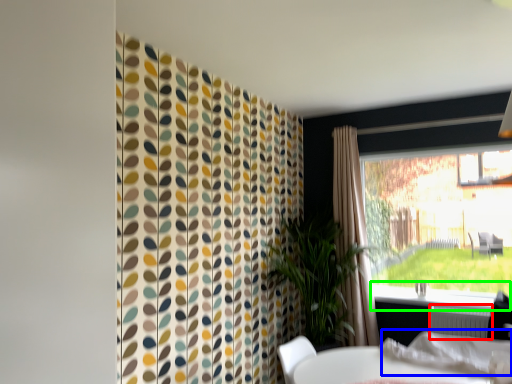
Question: Which is farther away from radiator (highlighted by a red box)? linen (highlighted by a blue box) or window sill (highlighted by a green box)?

Choices:
 (A) linen
 (B) window sill

Answer: (A)